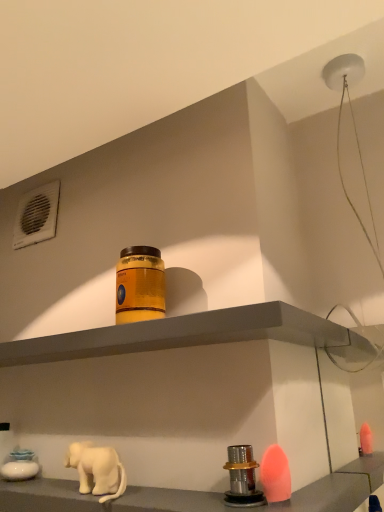
What are the coordinates of `free location to the right of white matte elephant at lower left` in the screenshot? It's located at (163, 493).